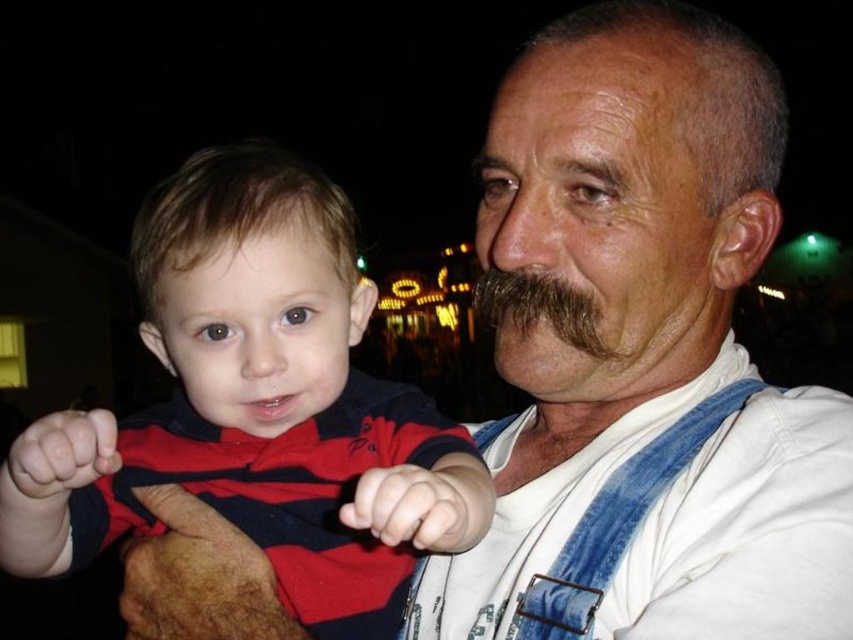
Question: Can you confirm if striped cotton shirt at left is smaller than brown fuzzy mustache at center?

Choices:
 (A) yes
 (B) no

Answer: (B)

Question: Does striped cotton shirt at left appear under blue denim suspenders at center?

Choices:
 (A) no
 (B) yes

Answer: (A)

Question: Which object is closer to the camera taking this photo?

Choices:
 (A) striped cotton shirt at left
 (B) blue denim suspenders at center

Answer: (A)

Question: Can you confirm if striped cotton shirt at left is positioned to the right of blue denim suspenders at center?

Choices:
 (A) no
 (B) yes

Answer: (A)

Question: Which point appears farthest from the camera in this image?

Choices:
 (A) click(x=646, y=477)
 (B) click(x=577, y=324)
 (C) click(x=235, y=195)

Answer: (B)

Question: Among these points, which one is nearest to the camera?

Choices:
 (A) [x=440, y=488]
 (B) [x=585, y=625]

Answer: (A)